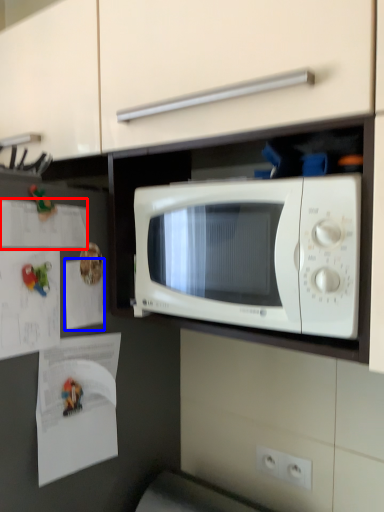
Question: Which object is further to the camera taking this photo, paper (highlighted by a red box) or paper (highlighted by a blue box)?

Choices:
 (A) paper
 (B) paper

Answer: (B)